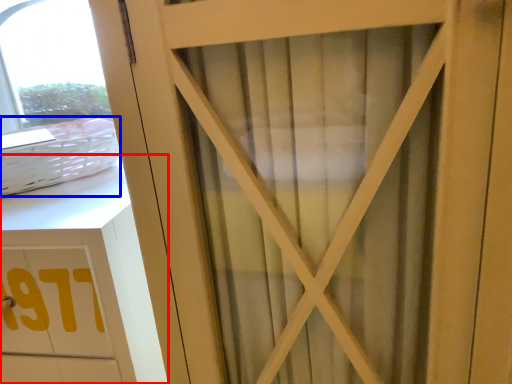
Question: Which object is closer to the camera taking this photo, cabinetry (highlighted by a red box) or basket (highlighted by a blue box)?

Choices:
 (A) cabinetry
 (B) basket

Answer: (A)